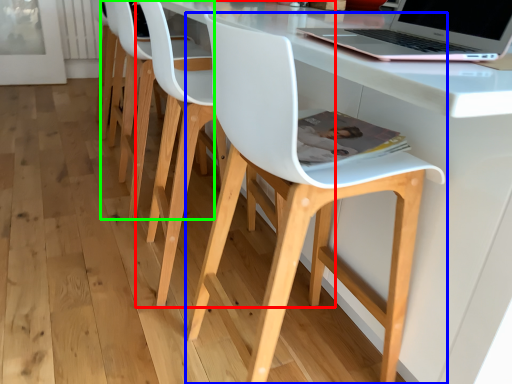
Question: Estimate the real-world distances between objects in this image. Which object is closer to chair (highlighted by a red box), chair (highlighted by a blue box) or chair (highlighted by a green box)?

Choices:
 (A) chair
 (B) chair

Answer: (B)